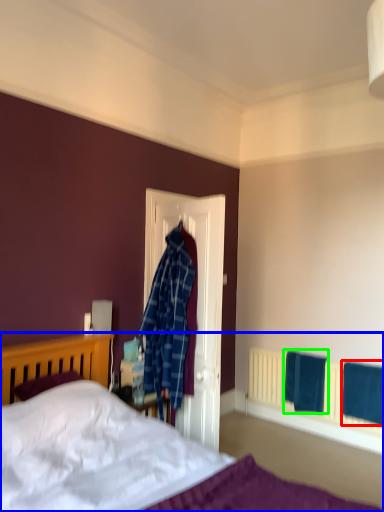
Question: Which is farther away from bath towel (highlighted by a red box)? bed (highlighted by a blue box) or bath towel (highlighted by a green box)?

Choices:
 (A) bed
 (B) bath towel

Answer: (B)